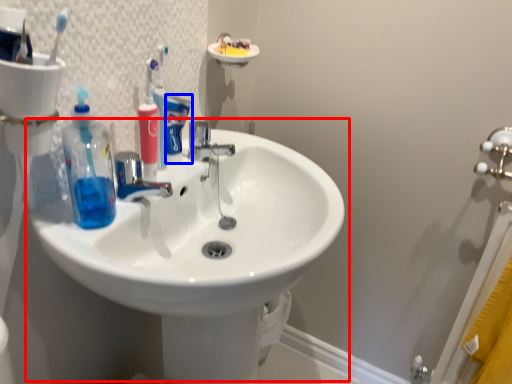
Question: Which point is further to the camera, sink (highlighted by a red box) or toothpaste (highlighted by a blue box)?

Choices:
 (A) sink
 (B) toothpaste

Answer: (B)